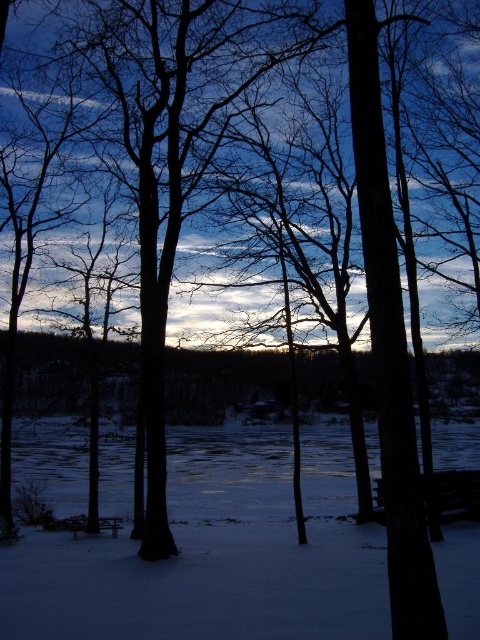
Can you confirm if white powdery snow at center is positioned to the left of wooden park bench at lower center?

Incorrect, white powdery snow at center is not on the left side of wooden park bench at lower center.

Who is taller, white powdery snow at center or wooden park bench at lower center?

white powdery snow at center

Is point (165, 621) closer to camera compared to point (90, 529)?

Yes, it is in front of point (90, 529).

Identify the location of white powdery snow at center. Image resolution: width=480 pixels, height=640 pixels. (216, 554).